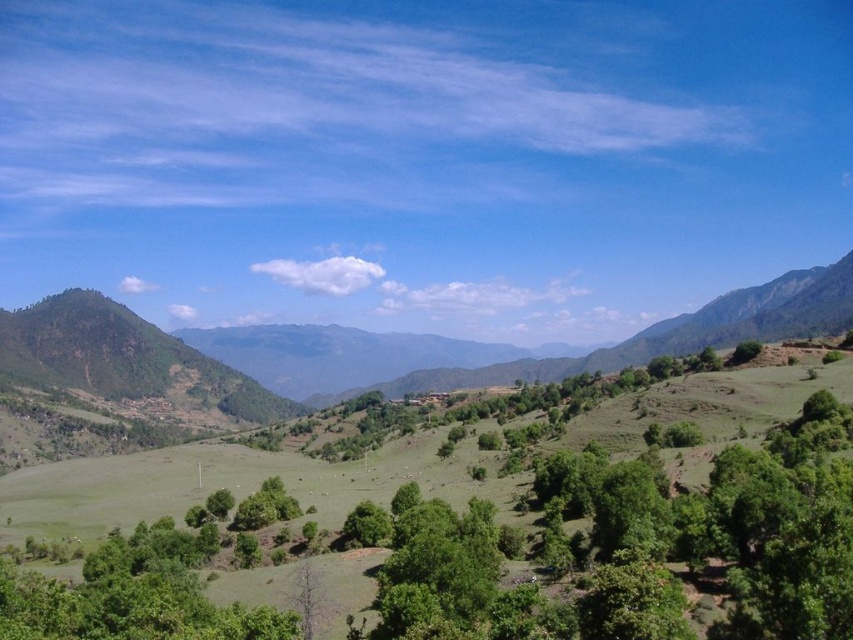
Can you confirm if green grassy hillside at left is positioned to the right of green leafy tree at center?

Correct, you'll find green grassy hillside at left to the right of green leafy tree at center.

Who is higher up, green grassy hillside at left or green leafy tree at center?

green grassy hillside at left is above.

Locate an element on the screen. The image size is (853, 640). green grassy hillside at left is located at coordinates (117, 348).

Find the location of a particular element. This screenshot has width=853, height=640. green grassy hillside at left is located at coordinates (117, 348).